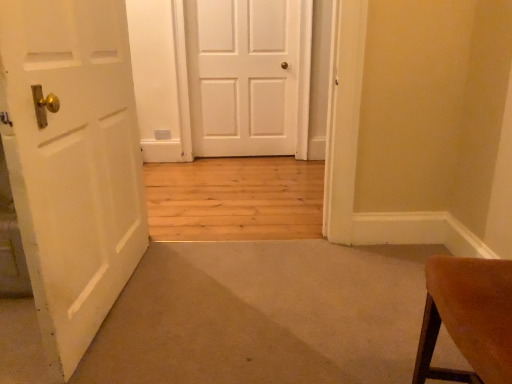
Question: Should I look upward or downward to see white matte door at center, marked as the 1th door in a bottom-to-top arrangement?

Choices:
 (A) down
 (B) up

Answer: (A)

Question: Does white matte door at center, which is counted as the second door, starting from the back, have a lesser width compared to white matte door at center, arranged as the second door when viewed from the front?

Choices:
 (A) yes
 (B) no

Answer: (B)

Question: Does white matte door at center, which is counted as the second door, starting from the back, have a smaller size compared to white matte door at center, which is counted as the second door, starting from the bottom?

Choices:
 (A) yes
 (B) no

Answer: (B)

Question: Is white matte door at center, which is the second door from top to bottom, positioned far away from white matte door at center, arranged as the second door when viewed from the front?

Choices:
 (A) no
 (B) yes

Answer: (B)

Question: Is the depth of white matte door at center, which is the second door from top to bottom, less than that of white matte door at center, arranged as the second door when viewed from the front?

Choices:
 (A) no
 (B) yes

Answer: (B)

Question: Does white matte door at center, marked as the 1th door in a bottom-to-top arrangement, come behind white matte door at center, which ranks as the first door in back-to-front order?

Choices:
 (A) yes
 (B) no

Answer: (B)

Question: Is white matte door at center, the first door from the front, looking in the opposite direction of white matte door at center, which is counted as the second door, starting from the bottom?

Choices:
 (A) yes
 (B) no

Answer: (B)

Question: Considering the relative sizes of white matte door at center, which is counted as the second door, starting from the bottom, and white matte door at center, the first door from the front, in the image provided, is white matte door at center, which is counted as the second door, starting from the bottom, taller than white matte door at center, the first door from the front,?

Choices:
 (A) no
 (B) yes

Answer: (B)

Question: Is the position of white matte door at center, arranged as the second door when viewed from the front, less distant than that of white matte door at center, marked as the 1th door in a bottom-to-top arrangement?

Choices:
 (A) yes
 (B) no

Answer: (B)

Question: From a real-world perspective, is white matte door at center, which is counted as the second door, starting from the bottom, under white matte door at center, which is the second door from top to bottom?

Choices:
 (A) no
 (B) yes

Answer: (A)

Question: Considering the relative sizes of white matte door at center, which is the 1th door from top to bottom, and white matte door at center, which is the second door from top to bottom, in the image provided, is white matte door at center, which is the 1th door from top to bottom, bigger than white matte door at center, which is the second door from top to bottom,?

Choices:
 (A) no
 (B) yes

Answer: (A)

Question: Can you confirm if white matte door at center, arranged as the second door when viewed from the front, is positioned to the left of white matte door at center, which is counted as the second door, starting from the back?

Choices:
 (A) yes
 (B) no

Answer: (B)

Question: From the image's perspective, is white matte door at center, arranged as the second door when viewed from the front, under white matte door at center, the first door from the front?

Choices:
 (A) yes
 (B) no

Answer: (B)

Question: From a real-world perspective, is white matte door at center, the first door from the front, physically located above or below white matte door at center, arranged as the second door when viewed from the front?

Choices:
 (A) above
 (B) below

Answer: (B)